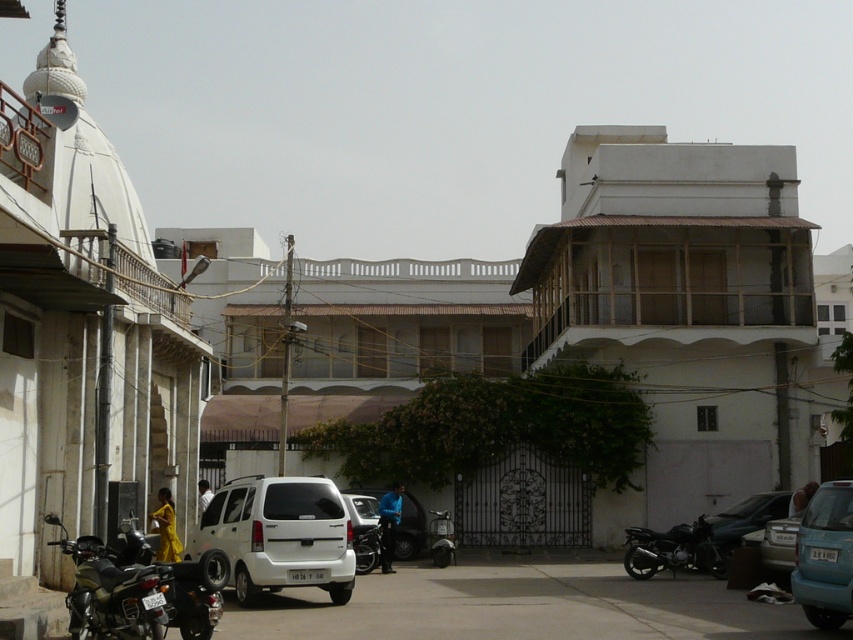
Question: Is shiny black motorcycle at lower right behind metallic silver scooter at center?

Choices:
 (A) yes
 (B) no

Answer: (B)

Question: Is white matte suv at center smaller than light blue matte car at center?

Choices:
 (A) yes
 (B) no

Answer: (B)

Question: Considering the real-world distances, which object is closest to the light blue matte car at center?

Choices:
 (A) matte black car at lower right
 (B) shiny black motorcycle at center

Answer: (A)

Question: Which point appears farthest from the camera in this image?

Choices:
 (A) (146, 554)
 (B) (340, 522)
 (C) (726, 544)
 (D) (370, 531)

Answer: (D)

Question: Can you confirm if shiny black motorcycle at lower right is thinner than metallic silver scooter at center?

Choices:
 (A) yes
 (B) no

Answer: (B)

Question: Which is farther from the metallic silver motorcycle at lower left?

Choices:
 (A) matte black car at lower right
 (B) shiny black motorcycle at lower left
 (C) matte black car at center
 (D) metallic silver scooter at center

Answer: (C)